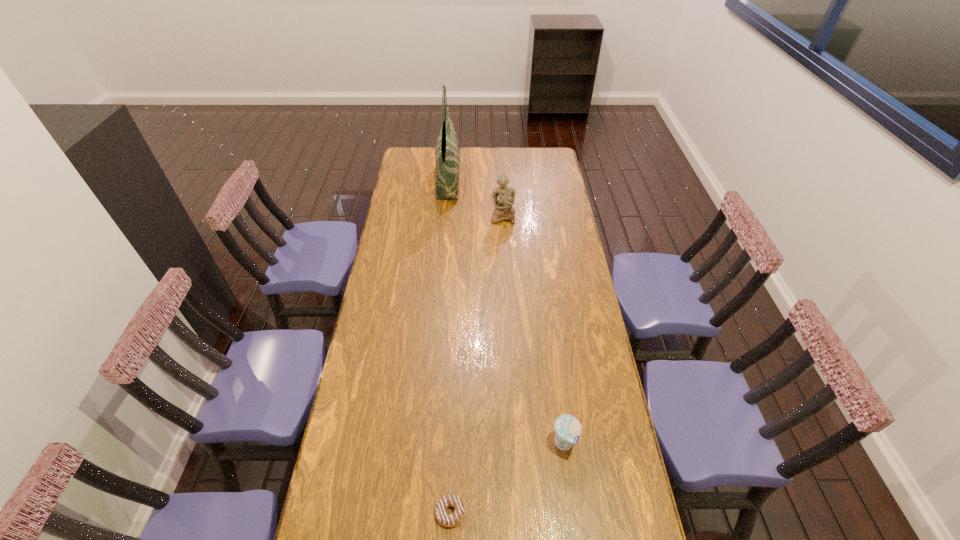
Find the location of `blank space located on the back of the second nearest object`. blank space located on the back of the second nearest object is located at coordinates (554, 373).

The width and height of the screenshot is (960, 540). Identify the location of free spot located 0.050m on the back of the nearest object. (452, 479).

Find the location of `object located at the far edge`. object located at the far edge is located at coordinates (447, 151).

You are a GUI agent. You are given a task and a screenshot of the screen. Output one action in this format:
    pyautogui.click(x=<x>, y=<y>)
    Task: Click on the object at the right edge
    The image size is (960, 540).
    Given the screenshot: What is the action you would take?
    pyautogui.click(x=567, y=428)

Image resolution: width=960 pixels, height=540 pixels. In order to click on free space at the far edge of the desktop in this screenshot , I will do pos(435,152).

This screenshot has width=960, height=540. Identify the location of free space at the left edge. (387, 284).

This screenshot has width=960, height=540. Find the location of `vacant space at the right edge of the desktop`. vacant space at the right edge of the desktop is located at coordinates (580, 310).

In the image, there is a desktop. Identify the location of vacant space at the far left corner. Image resolution: width=960 pixels, height=540 pixels. (413, 149).

You are a GUI agent. You are given a task and a screenshot of the screen. Output one action in this format:
    pyautogui.click(x=<x>, y=<y>)
    Task: Click on the free area in between the rightmost object and the figurine
    
    Given the screenshot: What is the action you would take?
    pyautogui.click(x=533, y=330)

What are the coordinates of `free area in between the nearest object and the third object from left to right` in the screenshot? It's located at (476, 364).